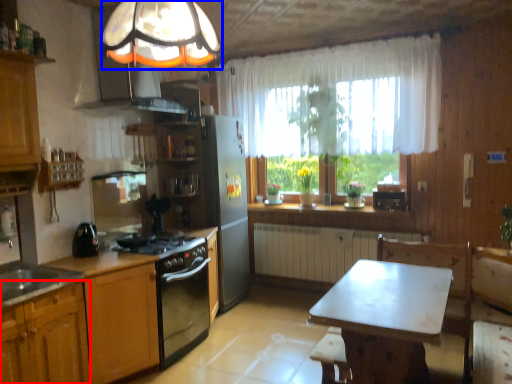
Question: Which object appears closest to the camera in this image, cabinetry (highlighted by a red box) or fixture (highlighted by a blue box)?

Choices:
 (A) cabinetry
 (B) fixture

Answer: (B)